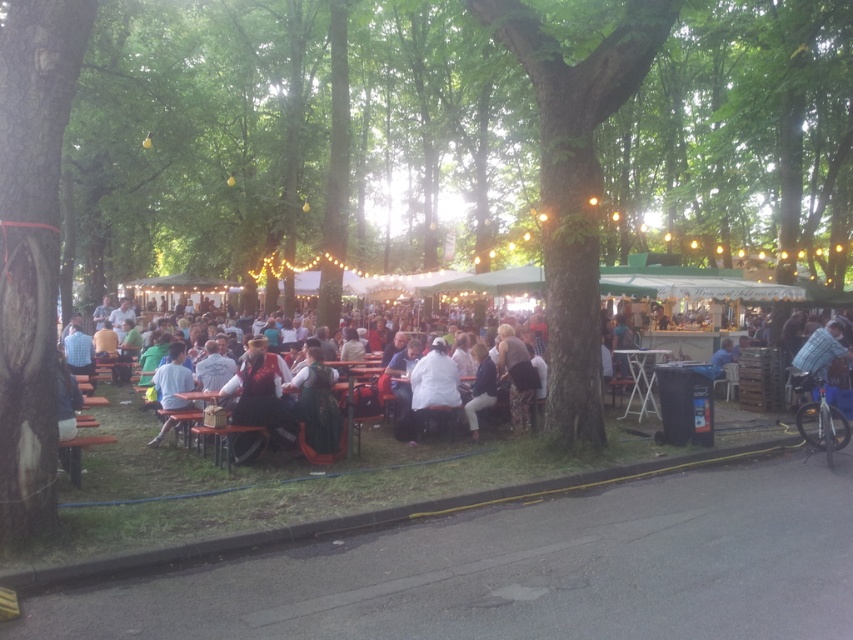
Measure the distance between green rough bark tree at center and white matte coat at center.

green rough bark tree at center and white matte coat at center are 7.74 feet apart from each other.

Which is above, green rough bark tree at center or white matte coat at center?

green rough bark tree at center is above.

What do you see at coordinates (575, 186) in the screenshot? This screenshot has width=853, height=640. I see `green rough bark tree at center` at bounding box center [575, 186].

The image size is (853, 640). Identify the location of green rough bark tree at center. (575, 186).

Which is above, green rough bark tree at left or dark brown leather jacket at center?

green rough bark tree at left is above.

Who is more forward, (3, 150) or (521, 372)?

Point (3, 150) is in front.

Which is behind, point (51, 48) or point (520, 364)?

The point (520, 364) is behind.

The height and width of the screenshot is (640, 853). I want to click on green rough bark tree at left, so click(32, 246).

Consider the image. Can you confirm if green rough bark tree at center is thinner than dark brown leather jacket at center?

Indeed, green rough bark tree at center has a lesser width compared to dark brown leather jacket at center.

Is green rough bark tree at center smaller than dark brown leather jacket at center?

Indeed, green rough bark tree at center has a smaller size compared to dark brown leather jacket at center.

Who is more forward, (579, 227) or (514, 401)?

Point (579, 227) is more forward.

Identify the location of green rough bark tree at center. (575, 186).